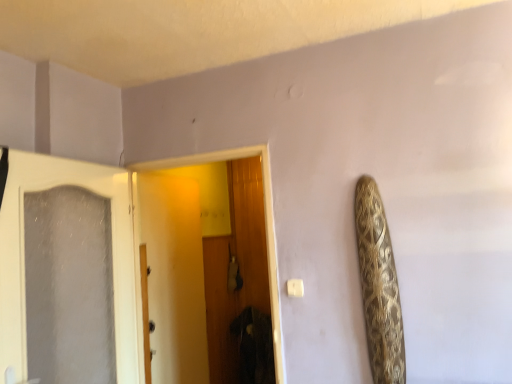
Question: From the image's perspective, is white frosted glass door at left, marked as the first door in a left-to-right arrangement, located above wooden door at center, which is the second door from left to right?

Choices:
 (A) yes
 (B) no

Answer: (B)

Question: Considering the relative sizes of white frosted glass door at left, marked as the first door in a left-to-right arrangement, and wooden door at center, positioned as the 1th door in right-to-left order, in the image provided, is white frosted glass door at left, marked as the first door in a left-to-right arrangement, wider than wooden door at center, positioned as the 1th door in right-to-left order,?

Choices:
 (A) yes
 (B) no

Answer: (B)

Question: Is white frosted glass door at left, marked as the first door in a left-to-right arrangement, in contact with wooden door at center, positioned as the 1th door in right-to-left order?

Choices:
 (A) no
 (B) yes

Answer: (A)

Question: Does white frosted glass door at left, marked as the first door in a left-to-right arrangement, have a lesser width compared to wooden door at center, which is the second door from left to right?

Choices:
 (A) no
 (B) yes

Answer: (B)

Question: From a real-world perspective, is white frosted glass door at left, arranged as the second door when viewed from the right, physically above wooden door at center, positioned as the 1th door in right-to-left order?

Choices:
 (A) yes
 (B) no

Answer: (A)

Question: Could you tell me if white frosted glass door at left, marked as the first door in a left-to-right arrangement, is facing wooden door at center, positioned as the 1th door in right-to-left order?

Choices:
 (A) no
 (B) yes

Answer: (B)

Question: Is wooden door at center, positioned as the 1th door in right-to-left order, bigger than white frosted glass door at left, arranged as the second door when viewed from the right?

Choices:
 (A) no
 (B) yes

Answer: (B)

Question: Can you confirm if wooden door at center, which is the second door from left to right, is positioned to the left of white frosted glass door at left, marked as the first door in a left-to-right arrangement?

Choices:
 (A) no
 (B) yes

Answer: (A)

Question: Is wooden door at center, positioned as the 1th door in right-to-left order, placed right next to white frosted glass door at left, arranged as the second door when viewed from the right?

Choices:
 (A) no
 (B) yes

Answer: (A)

Question: Can you confirm if wooden door at center, positioned as the 1th door in right-to-left order, is positioned to the right of white frosted glass door at left, arranged as the second door when viewed from the right?

Choices:
 (A) no
 (B) yes

Answer: (B)

Question: Could you tell me if wooden door at center, which is the second door from left to right, is facing white frosted glass door at left, arranged as the second door when viewed from the right?

Choices:
 (A) yes
 (B) no

Answer: (A)

Question: Can you confirm if wooden door at center, positioned as the 1th door in right-to-left order, is smaller than white frosted glass door at left, marked as the first door in a left-to-right arrangement?

Choices:
 (A) yes
 (B) no

Answer: (B)

Question: Does point (278, 347) appear closer or farther from the camera than point (15, 198)?

Choices:
 (A) farther
 (B) closer

Answer: (A)